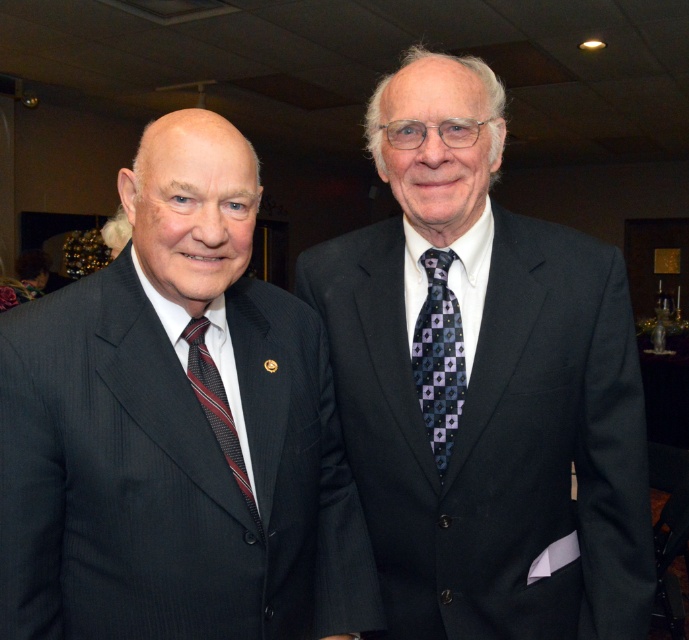
Image resolution: width=689 pixels, height=640 pixels. What do you see at coordinates (438, 356) in the screenshot? I see `dark blue textured tie at center` at bounding box center [438, 356].

Does dark blue textured tie at center come in front of striped silk tie at left?

That is False.

Between point (422, 312) and point (227, 448), which one is positioned behind?

The point (422, 312) is more distant.

Locate an element on the screen. The height and width of the screenshot is (640, 689). dark blue textured tie at center is located at coordinates (438, 356).

Is point (305, 280) positioned after point (446, 429)?

Yes, point (305, 280) is farther from viewer.

Is dark gray suit at right shorter than dark blue textured tie at center?

In fact, dark gray suit at right may be taller than dark blue textured tie at center.

Is point (491, 227) positioned before point (440, 394)?

No, (491, 227) is behind (440, 394).

Identify the location of dark gray suit at right. The image size is (689, 640). (483, 385).

Does dark gray suit at right have a lesser width compared to striped silk tie at left?

No, dark gray suit at right is not thinner than striped silk tie at left.

Is point (342, 348) farther from viewer compared to point (194, 342)?

Yes, point (342, 348) is farther from viewer.

What do you see at coordinates (483, 385) in the screenshot?
I see `dark gray suit at right` at bounding box center [483, 385].

At what (x,y) coordinates should I click in order to perform the action: click on dark gray suit at right. Please return your answer as a coordinate pair (x, y). Image resolution: width=689 pixels, height=640 pixels. Looking at the image, I should click on (483, 385).